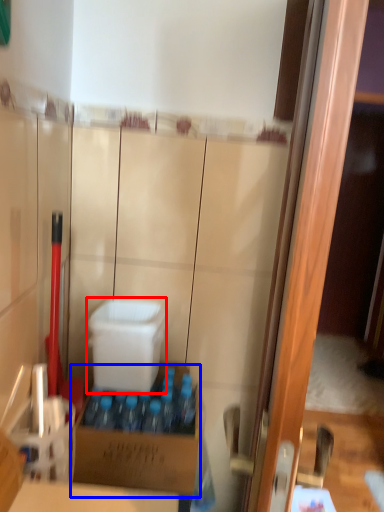
Question: Which point is further to the camera, box (highlighted by a red box) or box (highlighted by a blue box)?

Choices:
 (A) box
 (B) box

Answer: (A)